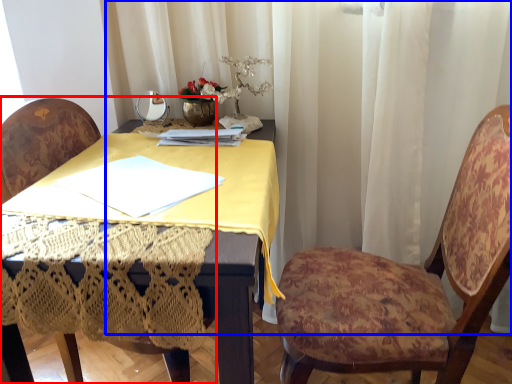
Question: Which object appears closest to the camera in this image, chair (highlighted by a red box) or curtain (highlighted by a blue box)?

Choices:
 (A) chair
 (B) curtain

Answer: (A)